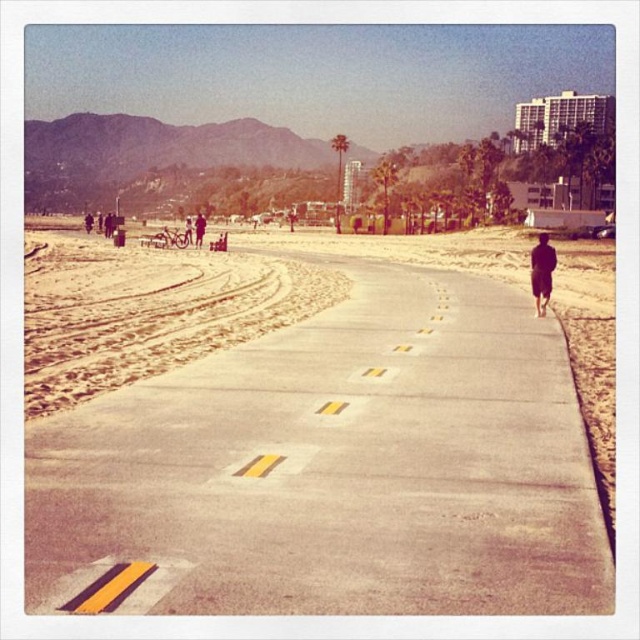
You are a construction worker who needs to place a 2.5 meter tall safety barrier on the beach. The barrier must be placed on either the concrete at center or the sandy yellow at left. Which location can accommodate the barrier based on their heights?

The concrete at center is shorter than sandy yellow at left, so the sandy yellow at left can accommodate the 2.5 meter tall safety barrier since it is taller than the concrete at center.

You are standing on the beach and see the sandy yellow at left and the dark blue fabric at center. Which object is nearer to you?

The sandy yellow at left is closer to the viewer than the dark blue fabric at center.

You are a photographer standing at the edge of the paved path. You see a black matte jacket at right and a dark blue fabric at center. Which object is closer to your right side?

The black matte jacket at right is closer to your right side because it is positioned to the right of the dark blue fabric at center.